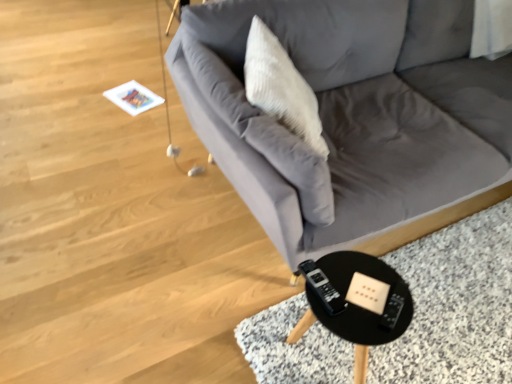
Question: From a real-world perspective, is black plastic table at lower right under gray fabric couch at center?

Choices:
 (A) yes
 (B) no

Answer: (A)

Question: Is gray fabric couch at center surrounded by black plastic table at lower right?

Choices:
 (A) no
 (B) yes

Answer: (A)

Question: Is black plastic table at lower right looking in the opposite direction of gray fabric couch at center?

Choices:
 (A) yes
 (B) no

Answer: (A)

Question: Considering the relative sizes of black plastic table at lower right and gray fabric couch at center in the image provided, is black plastic table at lower right wider than gray fabric couch at center?

Choices:
 (A) yes
 (B) no

Answer: (B)

Question: Could you tell me if black plastic table at lower right is facing gray fabric couch at center?

Choices:
 (A) no
 (B) yes

Answer: (A)

Question: Considering the positions of point (268, 44) and point (377, 291), is point (268, 44) closer or farther from the camera than point (377, 291)?

Choices:
 (A) farther
 (B) closer

Answer: (A)

Question: From the image's perspective, is white textured pillow at upper center positioned above or below black plastic table at lower right?

Choices:
 (A) above
 (B) below

Answer: (A)

Question: Is white textured pillow at upper center inside or outside of black plastic table at lower right?

Choices:
 (A) outside
 (B) inside

Answer: (A)

Question: Is white textured pillow at upper center to the left or to the right of black plastic table at lower right in the image?

Choices:
 (A) right
 (B) left

Answer: (B)

Question: From the image's perspective, is black plastic table at lower right above or below gray fabric couch at center?

Choices:
 (A) below
 (B) above

Answer: (A)

Question: Considering the positions of point (332, 312) and point (418, 203), is point (332, 312) closer or farther from the camera than point (418, 203)?

Choices:
 (A) farther
 (B) closer

Answer: (B)

Question: Considering the positions of black plastic table at lower right and gray fabric couch at center in the image, is black plastic table at lower right wider or thinner than gray fabric couch at center?

Choices:
 (A) thin
 (B) wide

Answer: (A)

Question: In terms of size, does black plastic table at lower right appear bigger or smaller than gray fabric couch at center?

Choices:
 (A) small
 (B) big

Answer: (A)

Question: Is gray fabric couch at center inside the boundaries of white textured pillow at upper center, or outside?

Choices:
 (A) outside
 (B) inside

Answer: (A)

Question: In terms of size, does gray fabric couch at center appear bigger or smaller than white textured pillow at upper center?

Choices:
 (A) big
 (B) small

Answer: (A)